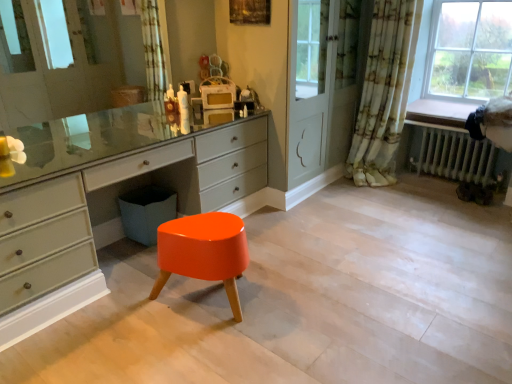
Image resolution: width=512 pixels, height=384 pixels. In order to click on blank space to the left of metallic radiator at lower right in this screenshot , I will do `click(406, 198)`.